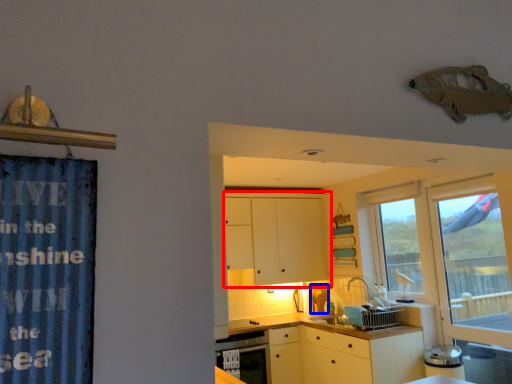
Question: Which of the following is the farthest to the observer, cabinetry (highlighted by a red box) or appliance (highlighted by a blue box)?

Choices:
 (A) cabinetry
 (B) appliance

Answer: (B)